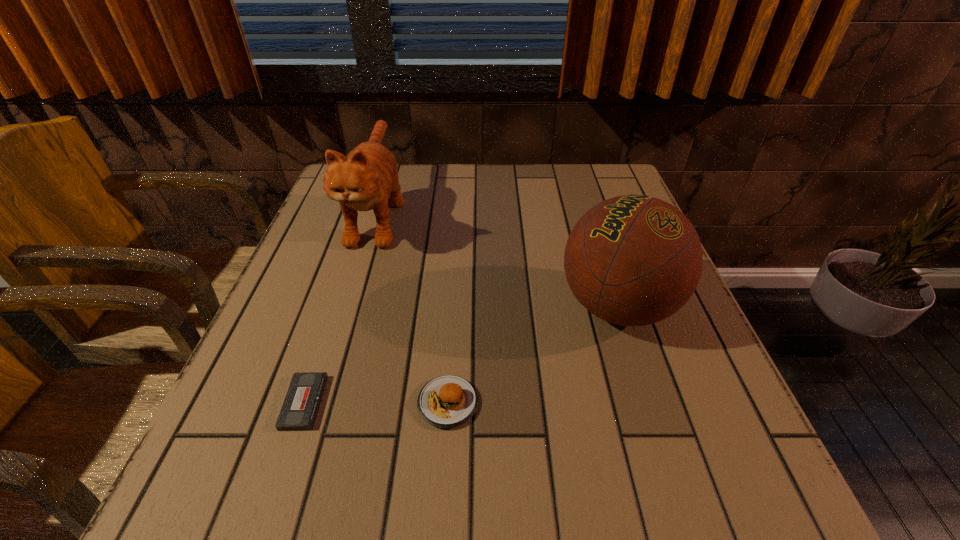
Where is `empty space between the videotape and the third tallest object`? This screenshot has width=960, height=540. empty space between the videotape and the third tallest object is located at coordinates (376, 402).

Find the location of `free space between the farthest object and the shortest object`. free space between the farthest object and the shortest object is located at coordinates (341, 308).

Where is `empty space between the second shortest object and the shortest object`? This screenshot has height=540, width=960. empty space between the second shortest object and the shortest object is located at coordinates (376, 402).

In order to click on free space between the cat and the videotape in this screenshot , I will do `click(341, 308)`.

This screenshot has height=540, width=960. Find the location of `vacant space in between the cat and the rightmost object`. vacant space in between the cat and the rightmost object is located at coordinates (497, 260).

Find the location of a particular element. The height and width of the screenshot is (540, 960). vacant point located between the cat and the shortest object is located at coordinates (341, 308).

Identify the location of free space that is in between the food and the rightmost object. The height and width of the screenshot is (540, 960). (533, 355).

Find the location of a particular element. Image resolution: width=960 pixels, height=540 pixels. free space between the shortest object and the third nearest object is located at coordinates (461, 354).

The image size is (960, 540). I want to click on vacant region between the food and the third nearest object, so click(x=533, y=355).

At what (x,y) coordinates should I click in order to perform the action: click on free space between the cat and the rightmost object. Please return your answer as a coordinate pair (x, y). Looking at the image, I should click on (497, 260).